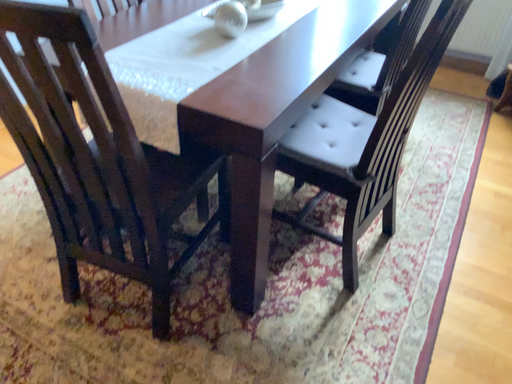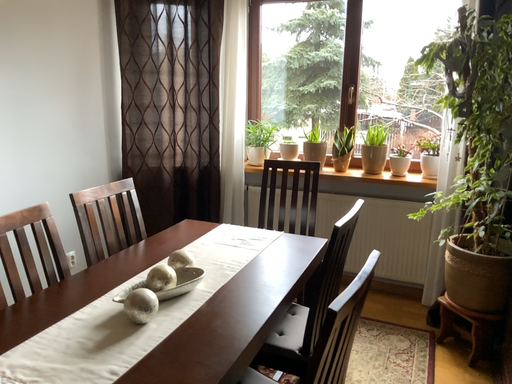
Question: Which way did the camera rotate in the video?

Choices:
 (A) rotated upward
 (B) rotated downward

Answer: (A)